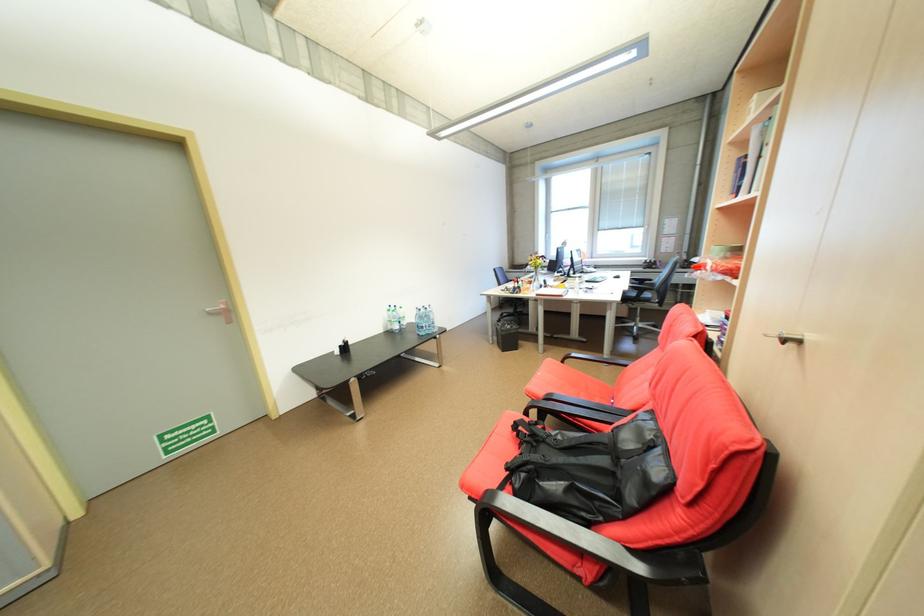
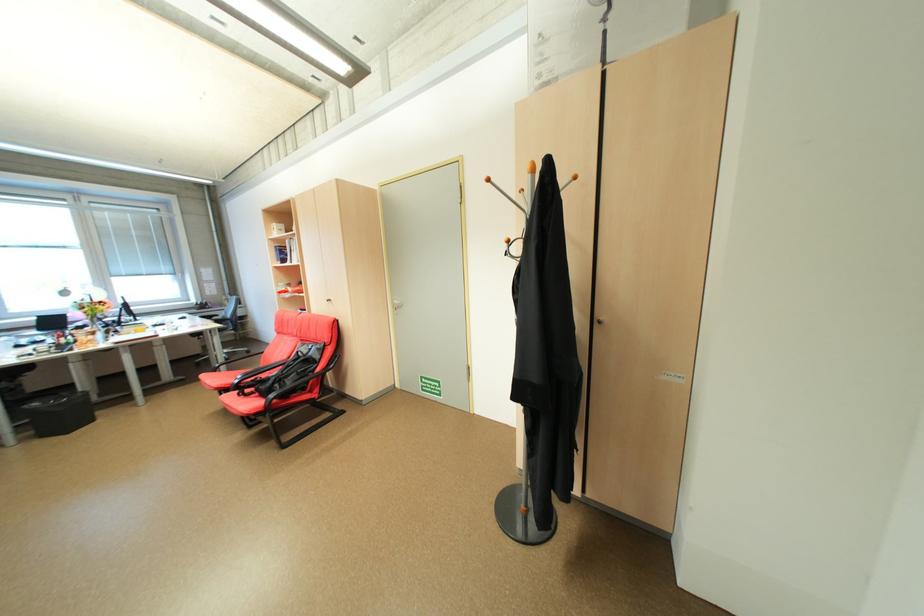
Locate, in the second image, the point that corresponds to point 532,476 in the first image.

(286, 386)